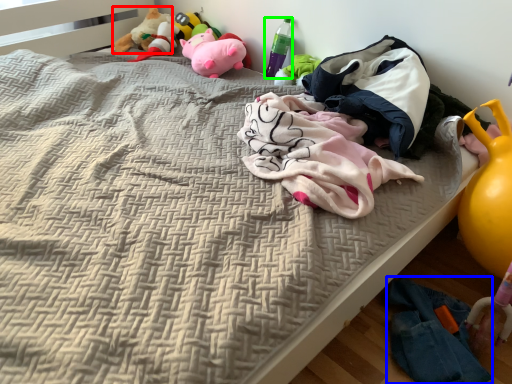
Question: Estimate the real-world distances between objects in this image. Which object is closer to toy (highlighted by a red box), clothing (highlighted by a blue box) or bottle (highlighted by a green box)?

Choices:
 (A) clothing
 (B) bottle

Answer: (B)